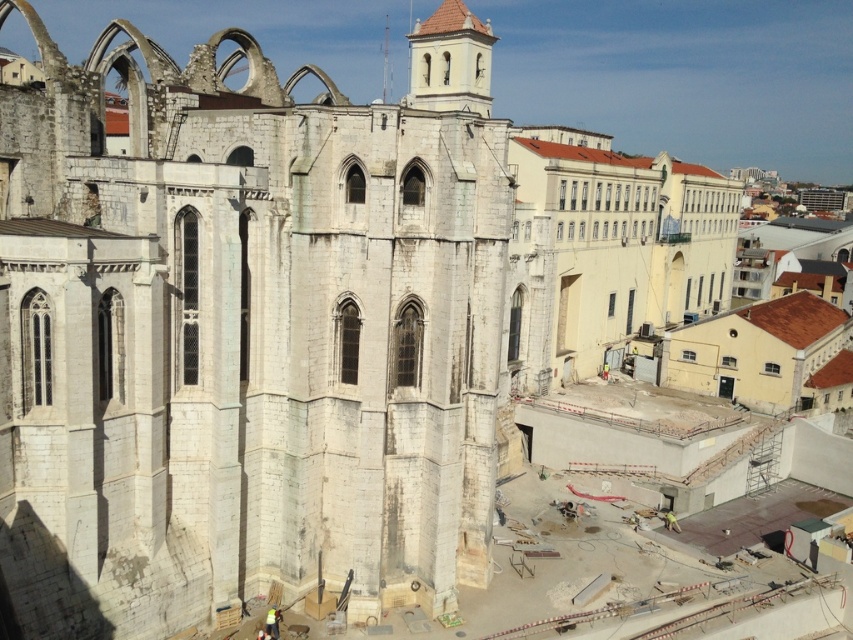
Question: Does white stone ruins at center have a greater width compared to smooth beige tower at center?

Choices:
 (A) yes
 (B) no

Answer: (A)

Question: Does white stone ruins at center come behind smooth beige tower at center?

Choices:
 (A) no
 (B) yes

Answer: (A)

Question: Which point appears closest to the camera in this image?

Choices:
 (A) (433, 61)
 (B) (242, 500)

Answer: (B)

Question: Which point is farther to the camera?

Choices:
 (A) (57, 188)
 (B) (421, 49)

Answer: (B)

Question: Does white stone ruins at center have a greater width compared to smooth beige tower at center?

Choices:
 (A) yes
 (B) no

Answer: (A)